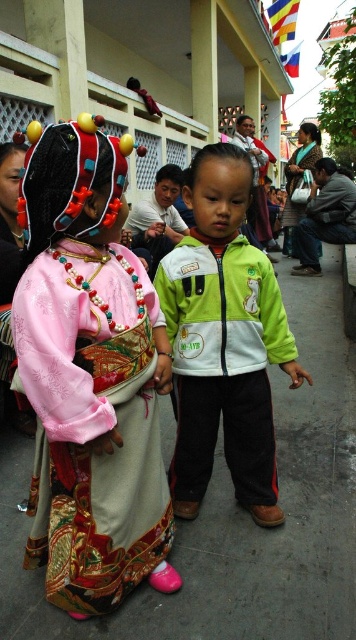
Question: Does green matte jacket at center have a larger size compared to dark gray fabric jacket at right?

Choices:
 (A) yes
 (B) no

Answer: (B)

Question: Does matte pink fabric dress at left appear on the right side of green fabric jacket at center?

Choices:
 (A) no
 (B) yes

Answer: (A)

Question: Among these objects, which one is nearest to the camera?

Choices:
 (A) white matte jacket at center
 (B) dark gray fabric jacket at right

Answer: (A)

Question: Which of these objects is positioned farthest from the matte pink fabric dress at left?

Choices:
 (A) white matte jacket at center
 (B) green fabric jacket at center
 (C) green matte jacket at center

Answer: (B)

Question: In this image, where is white matte jacket at center located relative to green fabric jacket at center?

Choices:
 (A) below
 (B) above

Answer: (A)

Question: Which of the following is the farthest from the observer?

Choices:
 (A) (220, 355)
 (B) (86, 212)

Answer: (A)